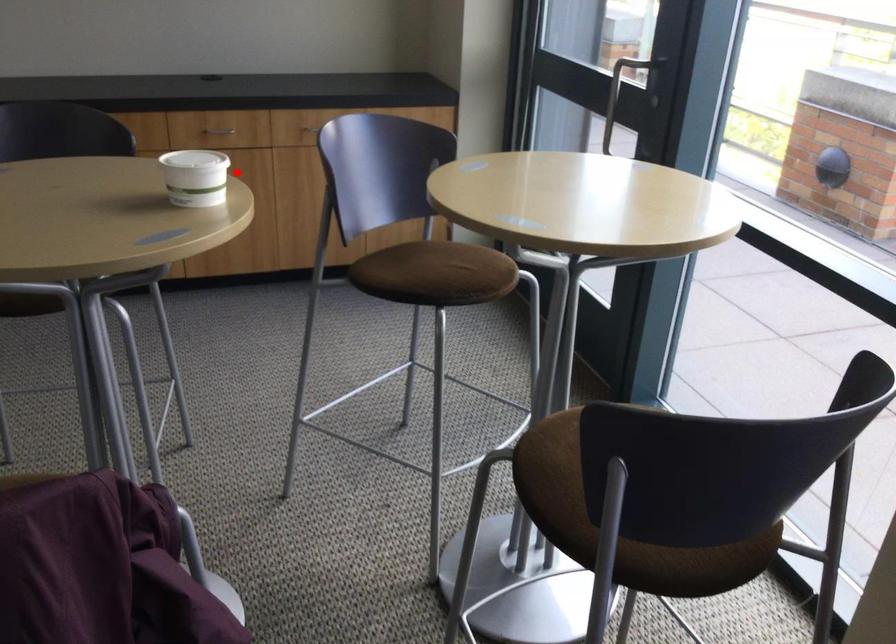
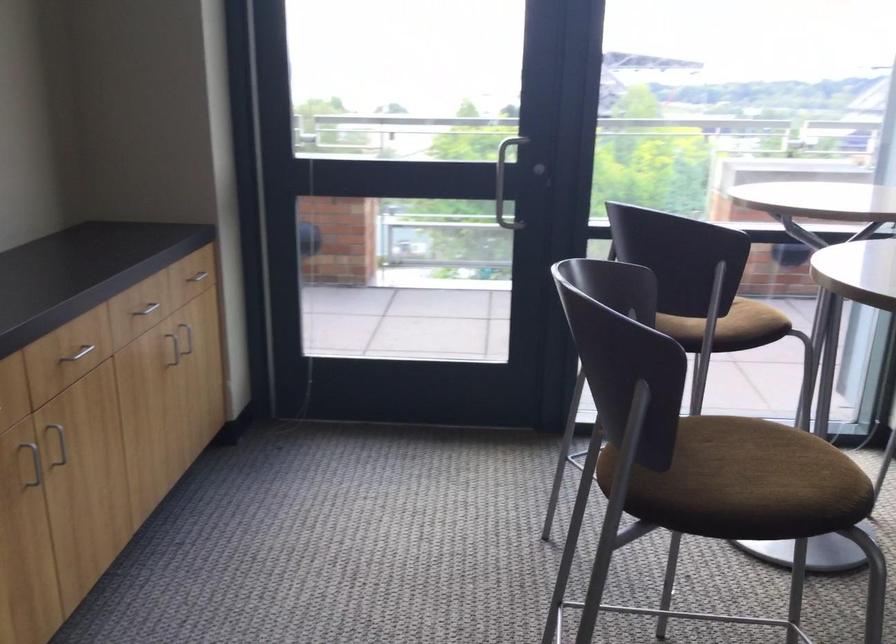
Question: I am providing you with two images of the same scene from different viewpoints. Image1 has a red point marked. In image2, the corresponding 3D location appears at what relative position? Reply with the corresponding letter.

Choices:
 (A) Closer
 (B) Farther

Answer: (A)